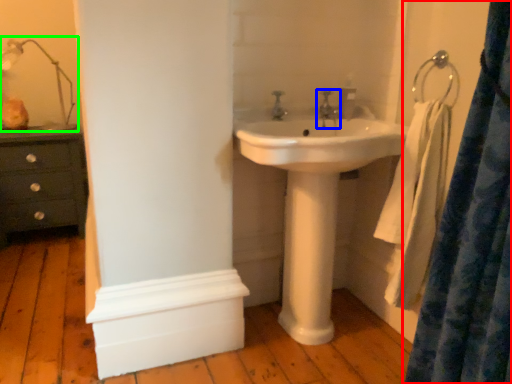
Question: Estimate the real-world distances between objects in this image. Which object is closer to curtain (highlighted by a red box), tap (highlighted by a blue box) or table lamp (highlighted by a green box)?

Choices:
 (A) tap
 (B) table lamp

Answer: (A)